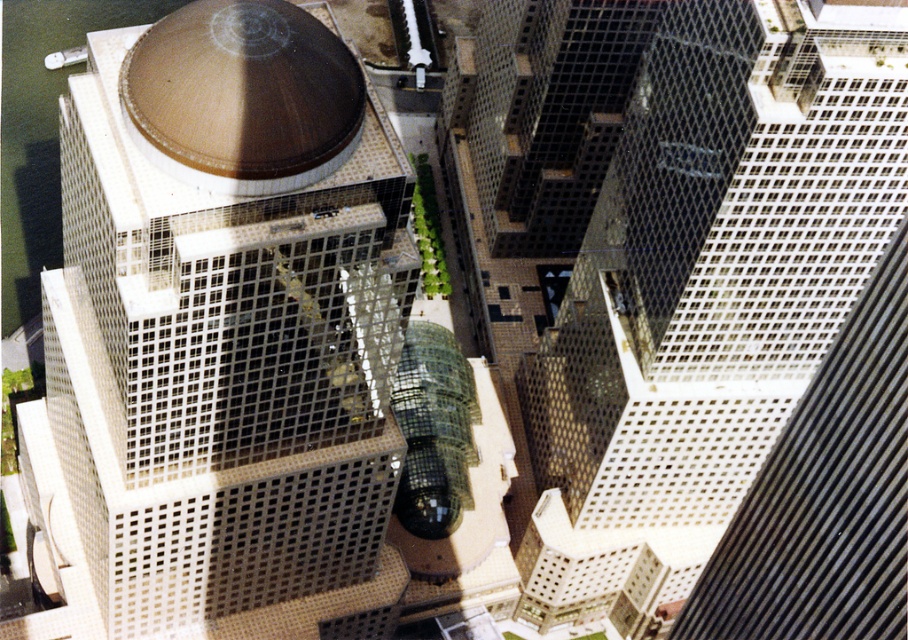
Between white grid-patterned building at center-left and white grid-patterned building at center-right, which one appears on the right side from the viewer's perspective?

white grid-patterned building at center-right

Does white grid-patterned building at center-left have a smaller size compared to white grid-patterned building at center-right?

No.

Between point (255, 355) and point (785, 310), which one is positioned behind?

The point (785, 310) is behind.

Locate an element on the screen. white grid-patterned building at center-left is located at coordinates (218, 326).